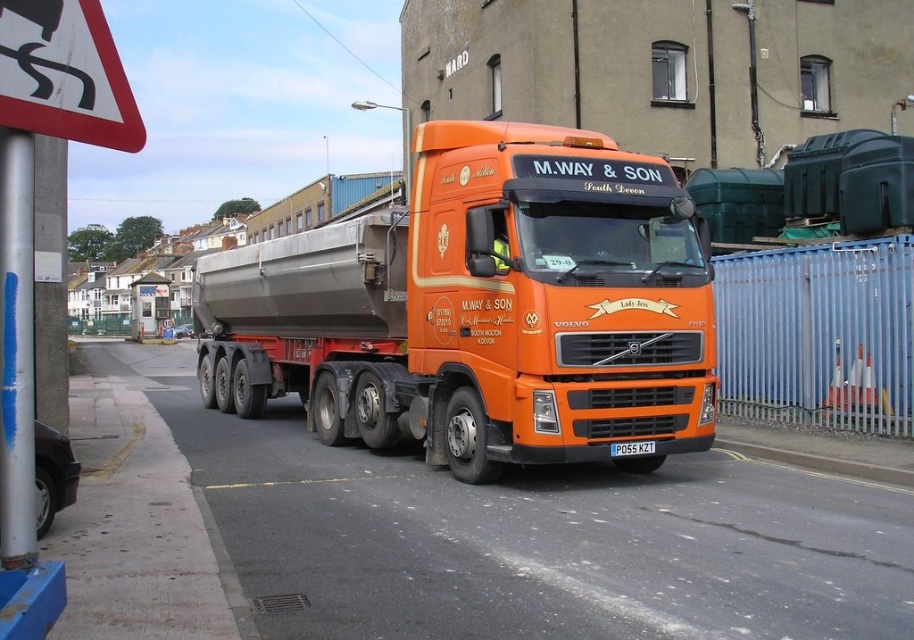
Based on the photo, is red plastic triangle at upper left positioned in front of white plastic license plate at center?

That is True.

The width and height of the screenshot is (914, 640). What do you see at coordinates (64, 74) in the screenshot? I see `red plastic triangle at upper left` at bounding box center [64, 74].

Where is `red plastic triangle at upper left`? Image resolution: width=914 pixels, height=640 pixels. red plastic triangle at upper left is located at coordinates (64, 74).

Can you confirm if orange matte truck at center is positioned above red plastic triangle at upper left?

Correct, orange matte truck at center is located above red plastic triangle at upper left.

Does point (534, 385) lie behind point (134, 129)?

Yes, it is behind point (134, 129).

Find the location of a particular element. This screenshot has width=914, height=640. orange matte truck at center is located at coordinates (481, 308).

Which is more to the right, orange matte truck at center or white plastic license plate at center?

From the viewer's perspective, white plastic license plate at center appears more on the right side.

Identify the location of orange matte truck at center. This screenshot has width=914, height=640. (481, 308).